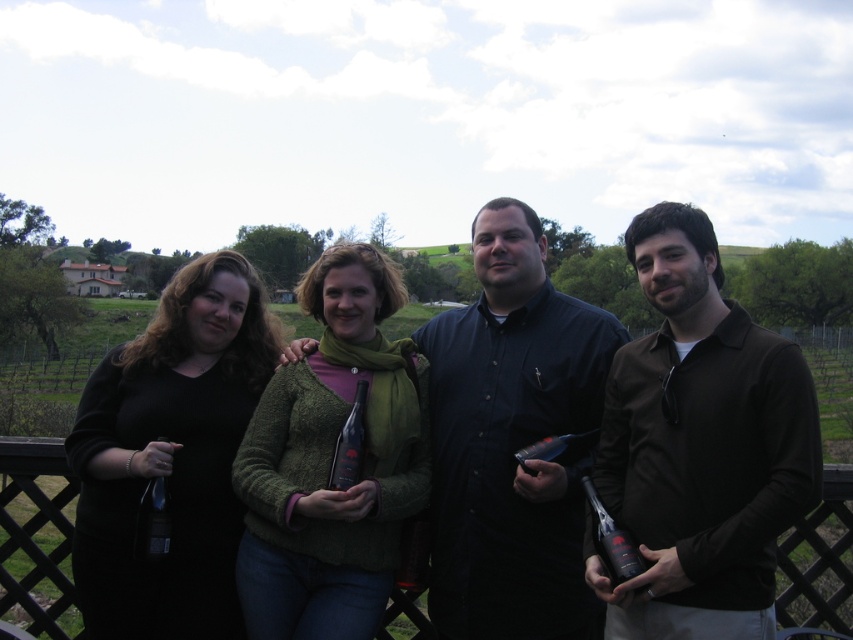
Looking at this image, who is higher up, green knitted sweater at center or matte glass beer bottle at center?

green knitted sweater at center is above.

Does point (328, 520) come closer to viewer compared to point (358, 468)?

Yes, point (328, 520) is closer to viewer.

Measure the distance between green knitted sweater at center and camera.

5.24 meters

Find the location of a particular element. The height and width of the screenshot is (640, 853). green knitted sweater at center is located at coordinates (331, 461).

Is brown matte shirt at center wider than green knitted sweater at center?

Yes, brown matte shirt at center is wider than green knitted sweater at center.

Between point (700, 477) and point (273, 616), which one is positioned in front?

Point (700, 477) is in front.

Locate an element on the screen. brown matte shirt at center is located at coordinates (700, 445).

Which is behind, point (671, 380) or point (637, 589)?

The point (671, 380) is behind.

Does brown matte shirt at center appear over matte black bottle at lower right?

Indeed, brown matte shirt at center is positioned over matte black bottle at lower right.

I want to click on brown matte shirt at center, so click(x=700, y=445).